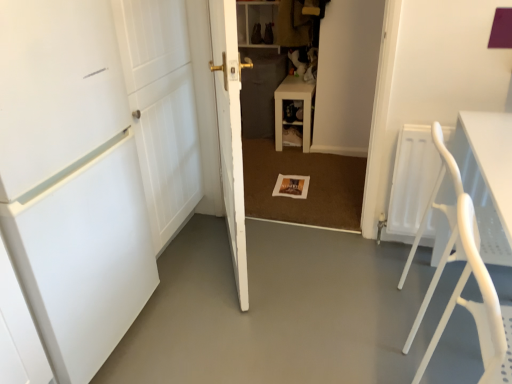
At what (x,y) coordinates should I click in order to perform the action: click on vacant area on the back side of white plastic folding chair at right. Please return your answer as a coordinate pair (x, y). Image resolution: width=512 pixels, height=384 pixels. Looking at the image, I should click on (391, 266).